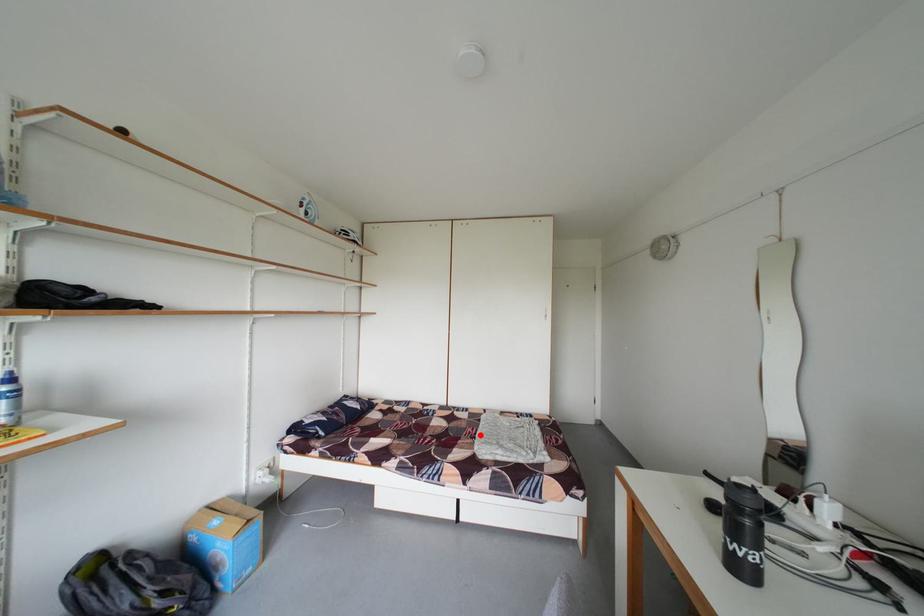
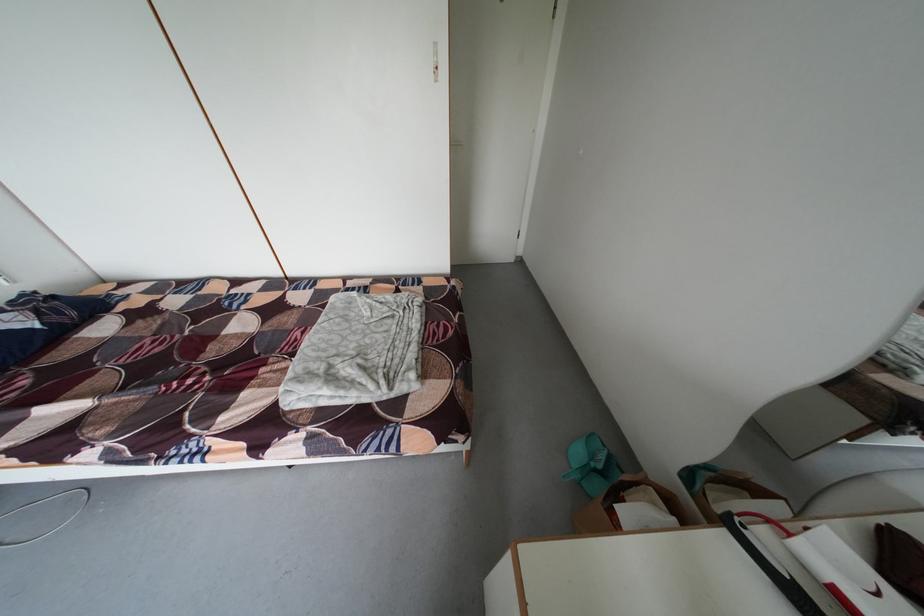
Where in the second image is the point corresponding to the highlighted location from the first image?

(309, 339)